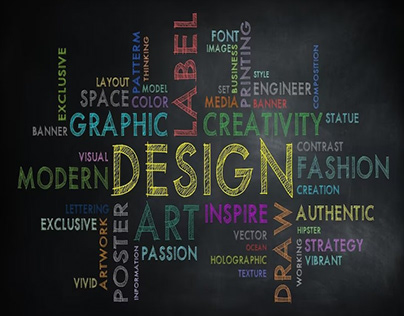
You are a GUI agent. You are given a task and a screenshot of the screen. Output one action in this format:
    pyautogui.click(x=<x>, y=<y>)
    Task: Click on the poster
    The height and width of the screenshot is (316, 404).
    Given the screenshot: What is the action you would take?
    [x=115, y=258]